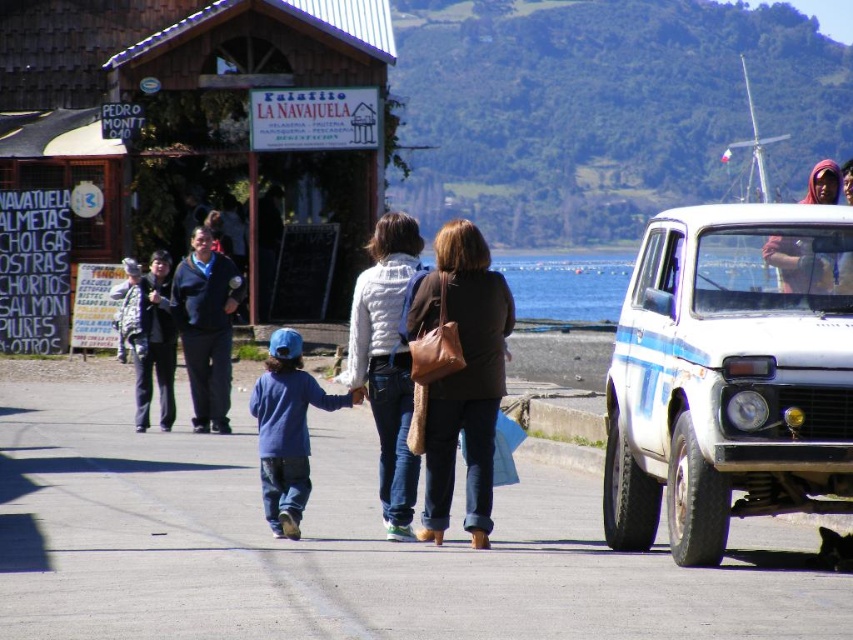
You are a photographer trying to capture a closeup of the white knit sweater at center and the blue cotton shirt at center. Which one should you zoom in on to ensure it fills the frame better?

The white knit sweater at center is larger in size than the blue cotton shirt at center, so you should zoom in on the white knit sweater at center to ensure it fills the frame better.

You are a photographer standing at the lakeside walkway. You want to take a photo of the dark blue sweater at center and the blue cotton shirt at center. Which one should you focus on first if you want to capture them both in the frame without moving your camera?

The dark blue sweater at center is to the left of the blue cotton shirt at center. To capture both in the frame without moving the camera, focus on the dark blue sweater at center first as it is closer to the left side, then ensure the blue cotton shirt at center is on the right side within the same frame.

You are standing at the center of the walkway and see the white matte car at right and the dark blue sweater at center. Which object is closer to you?

The dark blue sweater at center is closer to you since it is at the center of the walkway, while the white matte car at right is positioned further away at the right side of the image.